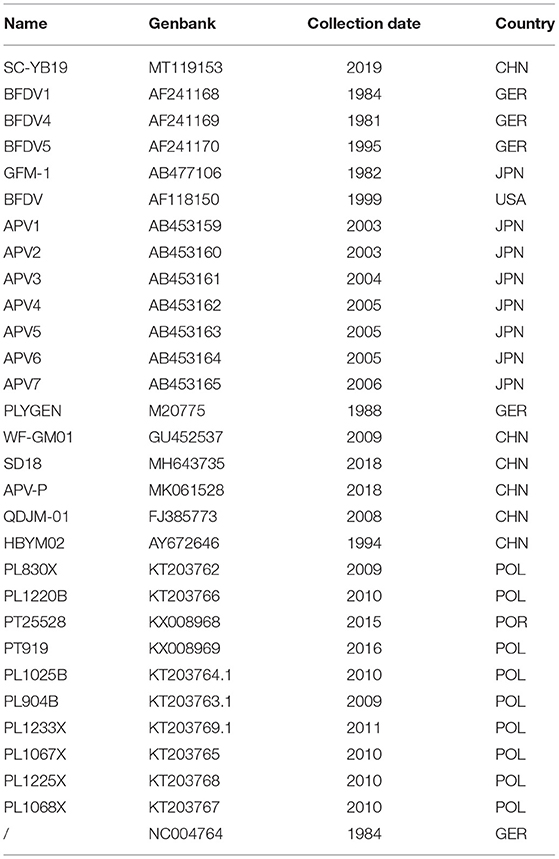
Where is `different columns`? different columns is located at coordinates (32, 21), (163, 15), (337, 27), (517, 23).